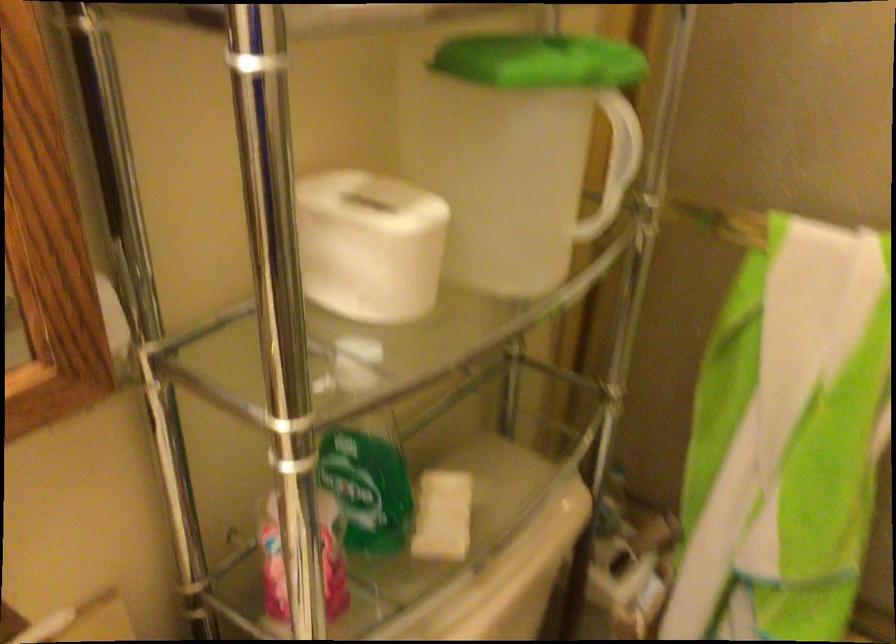
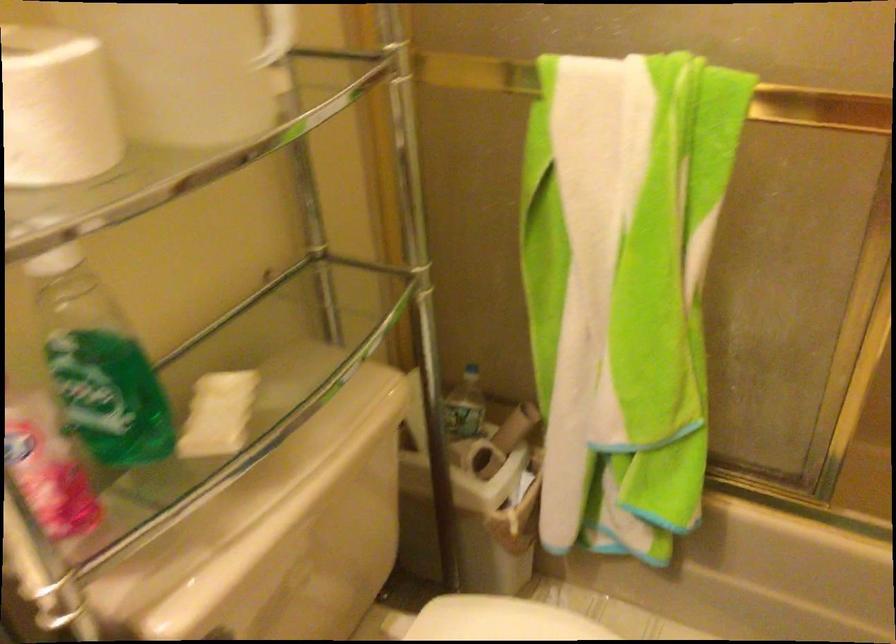
Question: Which direction would the cameraman need to move to produce the second image? Reply with the corresponding letter.

Choices:
 (A) Left
 (B) Right
 (C) Forward
 (D) Backward

Answer: (B)